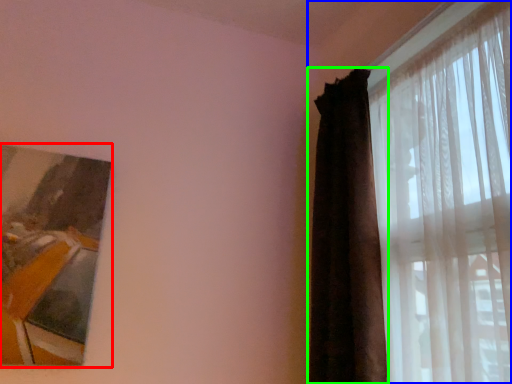
Question: Which object is the farthest from picture frame (highlighted by a red box)? Choose among these: curtain (highlighted by a blue box) or curtain (highlighted by a green box).

Choices:
 (A) curtain
 (B) curtain

Answer: (A)